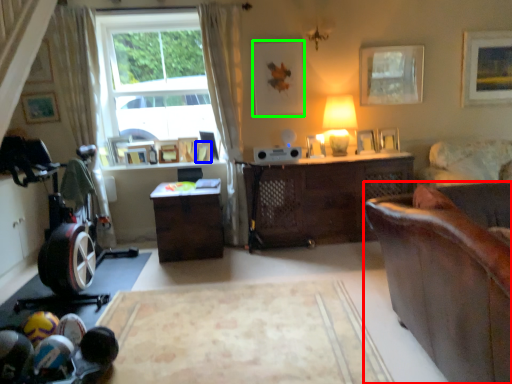
Question: Considering the real-world distances, which object is closest to studio couch (highlighted by a red box)? picture frame (highlighted by a blue box) or picture frame (highlighted by a green box).

Choices:
 (A) picture frame
 (B) picture frame

Answer: (B)